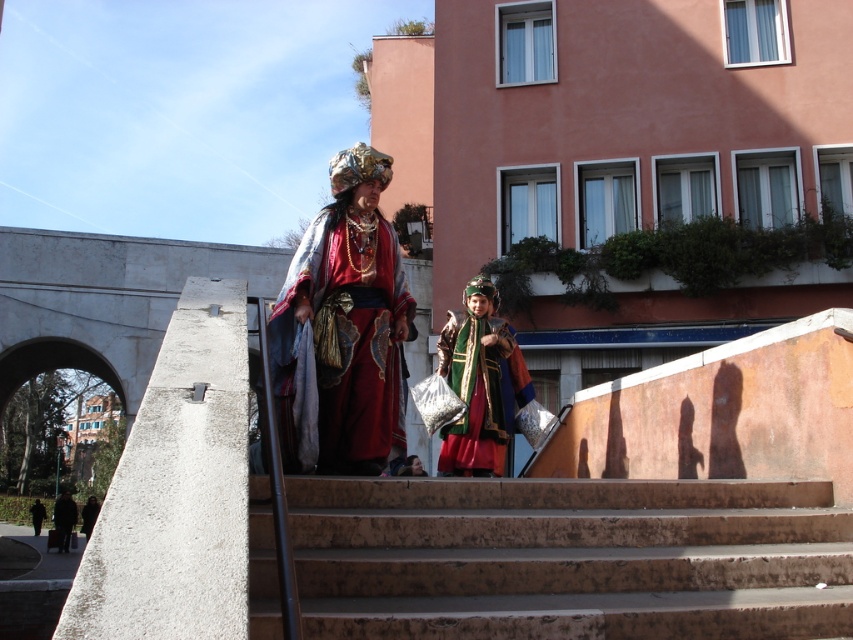
Does brown concrete stairs at center have a lesser width compared to velvet green coat at center?

No.

Between brown concrete stairs at center and velvet green coat at center, which one is positioned lower?

brown concrete stairs at center is below.

Locate an element on the screen. brown concrete stairs at center is located at coordinates (569, 557).

Is brown concrete stairs at center to the left of velvet red robe at center from the viewer's perspective?

Incorrect, brown concrete stairs at center is not on the left side of velvet red robe at center.

Is brown concrete stairs at center above velvet red robe at center?

Actually, brown concrete stairs at center is below velvet red robe at center.

Find the location of a particular element. This screenshot has height=640, width=853. brown concrete stairs at center is located at coordinates (569, 557).

Is velvet red robe at center wider than velvet green coat at center?

Incorrect, velvet red robe at center's width does not surpass velvet green coat at center's.

Is velvet red robe at center below velvet green coat at center?

No.

In order to click on velvet red robe at center in this screenshot , I will do `click(343, 340)`.

Find the location of `velvet red robe at center`. velvet red robe at center is located at coordinates (343, 340).